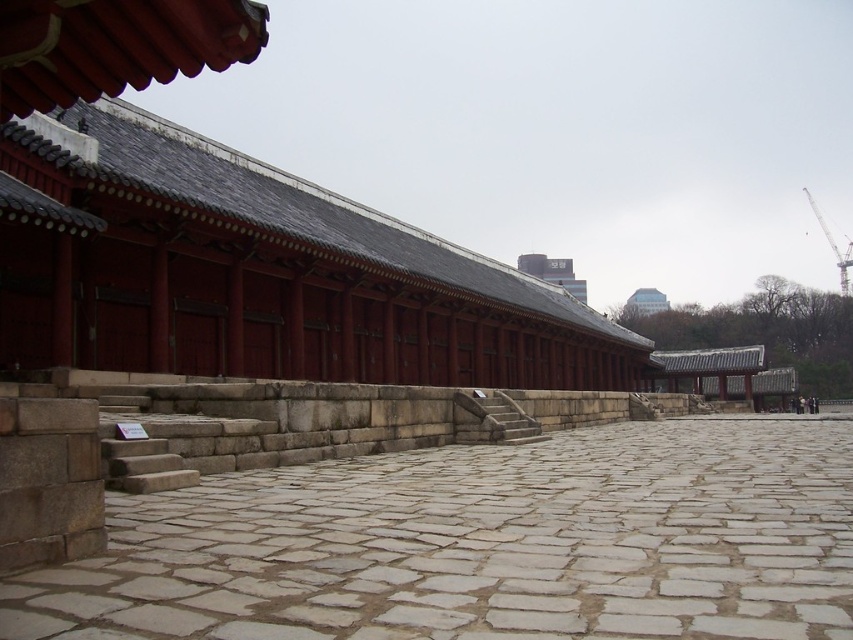
Can you confirm if gray stone courtyard at center is positioned to the left of matte red wood palace at center?

No, gray stone courtyard at center is not to the left of matte red wood palace at center.

Between gray stone courtyard at center and matte red wood palace at center, which one is positioned lower?

gray stone courtyard at center

Is point (688, 484) positioned before point (566, 378)?

Yes.

You are a GUI agent. You are given a task and a screenshot of the screen. Output one action in this format:
    pyautogui.click(x=<x>, y=<y>)
    Task: Click on the gray stone courtyard at center
    
    Given the screenshot: What is the action you would take?
    pyautogui.click(x=483, y=545)

Does matte gray stone palace at upper center have a greater height compared to white glass building at upper center?

Indeed, matte gray stone palace at upper center has a greater height compared to white glass building at upper center.

Does matte gray stone palace at upper center have a smaller size compared to white glass building at upper center?

No, matte gray stone palace at upper center is not smaller than white glass building at upper center.

This screenshot has width=853, height=640. I want to click on matte gray stone palace at upper center, so click(553, 273).

Image resolution: width=853 pixels, height=640 pixels. Identify the location of matte gray stone palace at upper center. (553, 273).

Who is positioned more to the left, matte red wood palace at center or white glass building at upper center?

matte red wood palace at center

Is matte red wood palace at center closer to the viewer compared to white glass building at upper center?

Yes, matte red wood palace at center is closer to the viewer.

Image resolution: width=853 pixels, height=640 pixels. I want to click on matte red wood palace at center, so click(258, 272).